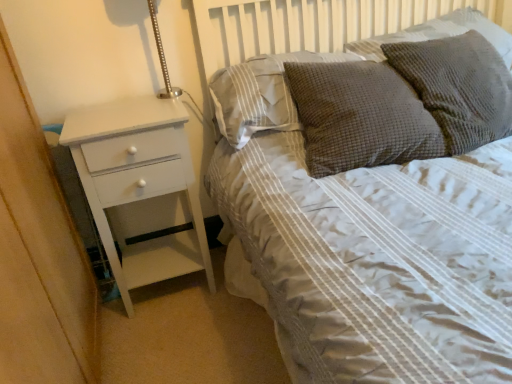
Question: Is brown textured pillow at upper center, which is the 1th pillow from left to right, to the left or to the right of white painted wood chest of drawers at left in the image?

Choices:
 (A) left
 (B) right

Answer: (B)

Question: Is brown textured pillow at upper center, which is the 1th pillow from left to right, inside or outside of white painted wood chest of drawers at left?

Choices:
 (A) outside
 (B) inside

Answer: (A)

Question: Which object is the farthest from the brown textured pillow at upper center, which is the 1th pillow from left to right?

Choices:
 (A) textured gray pillow at upper right, the 4th pillow viewed from the left
 (B) brown textured pillow at upper right, which is the 3th pillow in right-to-left order
 (C) white painted wood chest of drawers at left
 (D) textured gray pillow at upper right, positioned as the 3th pillow in left-to-right order

Answer: (A)

Question: Which object is the closest to the textured gray pillow at upper right, the 2th pillow positioned from the right?

Choices:
 (A) textured gray pillow at upper right, the 4th pillow viewed from the left
 (B) brown textured pillow at upper right, which is the 3th pillow in right-to-left order
 (C) white painted wood chest of drawers at left
 (D) brown textured pillow at upper center, which is the 1th pillow from left to right

Answer: (B)